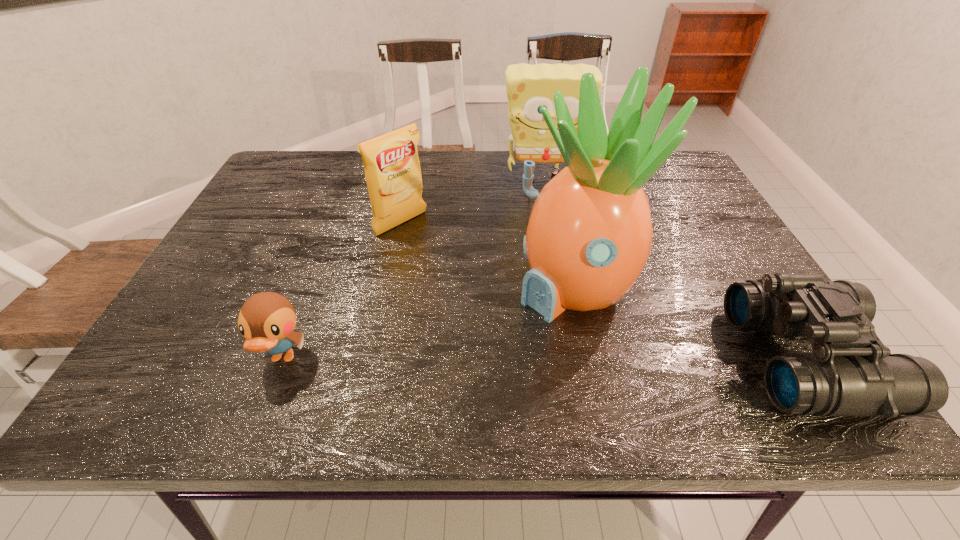
The width and height of the screenshot is (960, 540). I want to click on blank area located on the front of the second farthest object with the logo, so click(483, 286).

The width and height of the screenshot is (960, 540). I want to click on vacant space located on the front of the second farthest object with the logo, so click(483, 286).

Image resolution: width=960 pixels, height=540 pixels. What are the coordinates of `blank space located 0.110m on the front of the second farthest object with the logo` in the screenshot? It's located at 444,256.

Identify the location of vacant space situated at the entrance of the pineapple. The image size is (960, 540). (506, 343).

This screenshot has height=540, width=960. In order to click on vacant region located at the entrance of the pineapple in this screenshot , I will do `click(484, 360)`.

The height and width of the screenshot is (540, 960). Identify the location of vacant space located on the face of the second tallest object. (545, 206).

The width and height of the screenshot is (960, 540). In order to click on vacant area located on the face of the second tallest object in this screenshot , I will do `click(555, 269)`.

You are a GUI agent. You are given a task and a screenshot of the screen. Output one action in this format:
    pyautogui.click(x=<x>, y=<y>)
    Task: Click on the free spot located 0.300m on the face of the second tallest object
    
    Given the screenshot: What is the action you would take?
    pyautogui.click(x=554, y=264)

Find the location of `object situated at the far edge`. object situated at the far edge is located at coordinates (528, 87).

Locate an element on the screen. duck at the near edge is located at coordinates (266, 320).